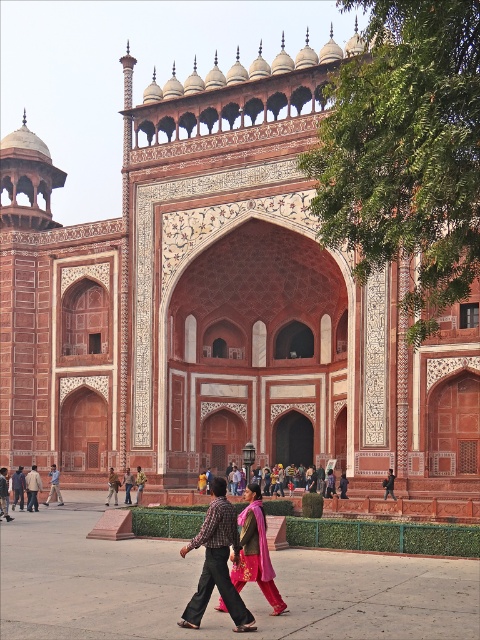
Question: Which object appears farthest from the camera in this image?

Choices:
 (A) light brown leather jacket at lower left
 (B) matte brown pants at center

Answer: (B)

Question: Is pink fabric saree at center behind light brown leather jacket at lower left?

Choices:
 (A) yes
 (B) no

Answer: (B)

Question: From the image, what is the correct spatial relationship of pink fabric saree at center in relation to light brown leather jacket at lower left?

Choices:
 (A) above
 (B) below

Answer: (A)

Question: Which point is farther from the camera taking this photo?

Choices:
 (A) (230, 554)
 (B) (127, 481)

Answer: (B)

Question: Which point is closer to the camera?

Choices:
 (A) pink fabric saree at center
 (B) matte brown pants at center
 (C) light brown leather jacket at lower left

Answer: (A)

Question: Is the position of pink fabric saree at center less distant than that of light brown leather jacket at lower left?

Choices:
 (A) yes
 (B) no

Answer: (A)